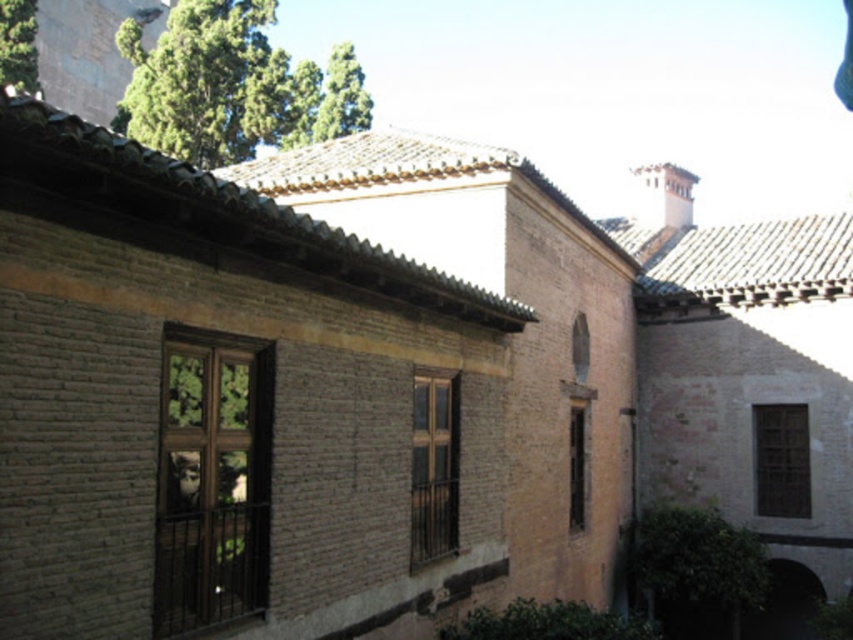
Question: Which point is closer to the camera taking this photo?

Choices:
 (A) (165, 572)
 (B) (575, 465)
 (C) (442, 476)
 (D) (795, 492)

Answer: (A)

Question: Which point is farther to the camera?

Choices:
 (A) (445, 451)
 (B) (805, 504)

Answer: (B)

Question: Can you confirm if wooden window at center is positioned to the left of matte brown wooden window at center-right?

Choices:
 (A) no
 (B) yes

Answer: (B)

Question: Can you confirm if brown wooden window at center is smaller than matte brown wooden window at center-right?

Choices:
 (A) yes
 (B) no

Answer: (B)

Question: Does brown wooden window at center lie in front of matte brown wooden window at center-right?

Choices:
 (A) yes
 (B) no

Answer: (A)

Question: Which object appears farthest from the camera in this image?

Choices:
 (A) matte brown wooden window at center-right
 (B) wooden window at center
 (C) brown wooden window at lower right
 (D) brown wooden window at center

Answer: (C)